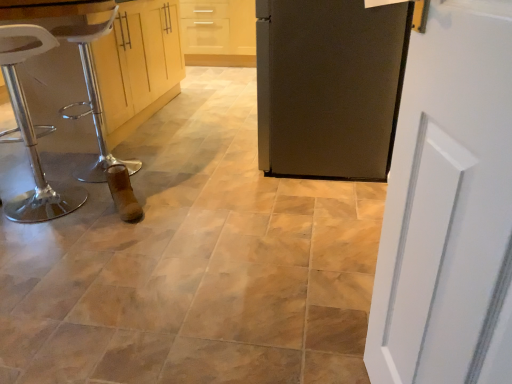
The image size is (512, 384). What are the coordinates of `unoccupied region to the right of white plastic bar stool at left` in the screenshot? It's located at (164, 168).